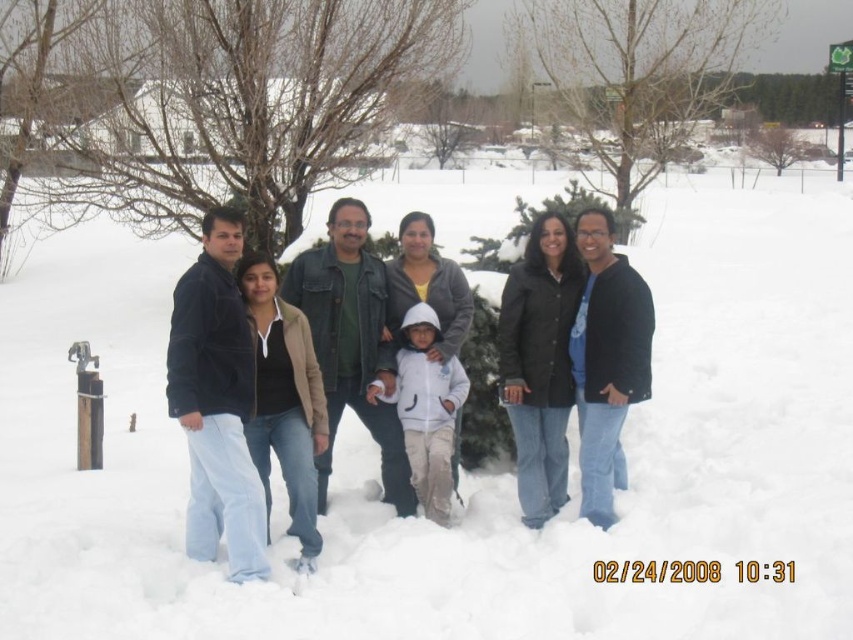
You are a photographer trying to adjust the spacing between the dark blue jacket at center and the black matte jacket at right so that they appear the same size in the photo. Given their current sizes, which adjustment should you make?

The dark blue jacket at center is bigger than the black matte jacket at right. To make them appear the same size in the photo, move the dark blue jacket at center farther away from the camera and bring the black matte jacket at right closer to the camera.

Consider the image. You are a photographer trying to adjust the composition of the group photo. You notice the dark blue jacket at center and the black matte jacket at right. Based on their positions, which jacket is positioned lower in the image?

The dark blue jacket at center is located below the black matte jacket at right, so it is positioned lower in the image.